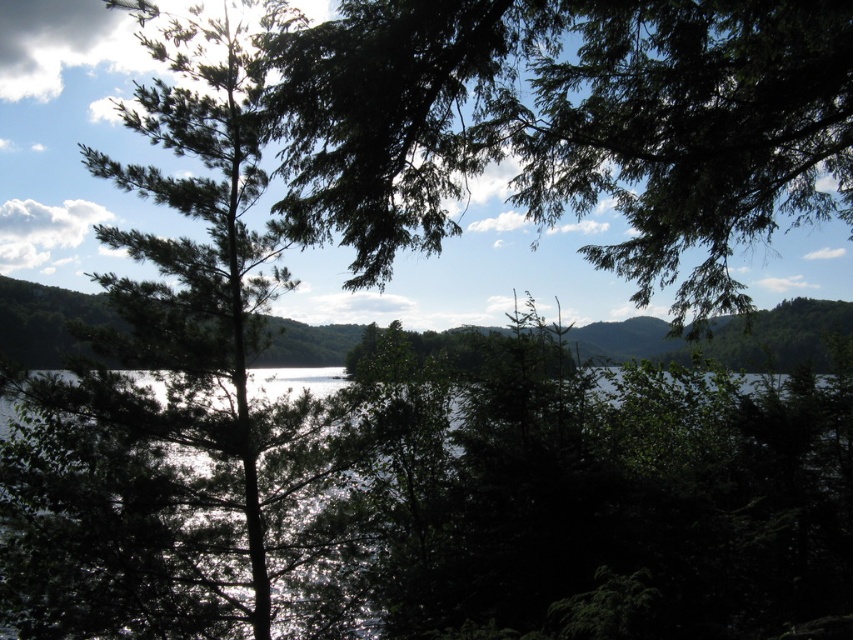
Who is taller, glistening water at center or green leafy tree at center?

With more height is green leafy tree at center.

Between point (845, 396) and point (811, 150), which one is positioned in front?

Point (811, 150) is in front.

In order to click on glistening water at center in this screenshot , I will do `click(563, 506)`.